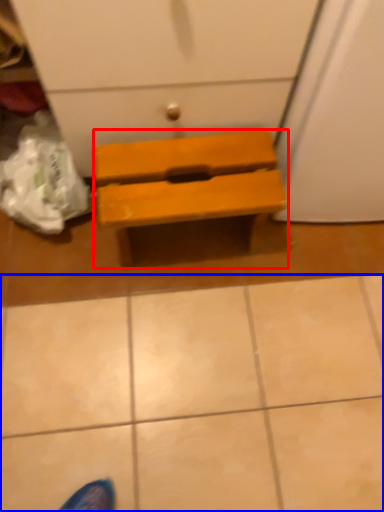
Question: Which point is further to the camera, furniture (highlighted by a red box) or tile (highlighted by a blue box)?

Choices:
 (A) furniture
 (B) tile

Answer: (A)